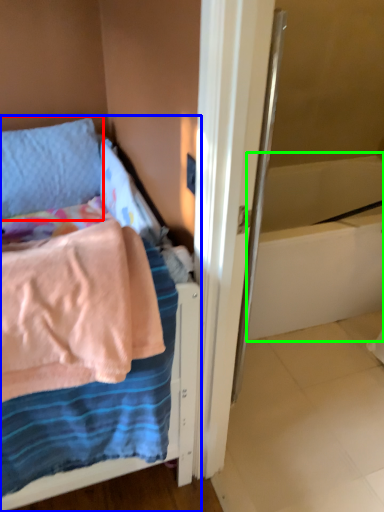
Question: Which object is the farthest from pillow (highlighted by a red box)? Choose among these: bed (highlighted by a blue box) or bath (highlighted by a green box).

Choices:
 (A) bed
 (B) bath

Answer: (B)